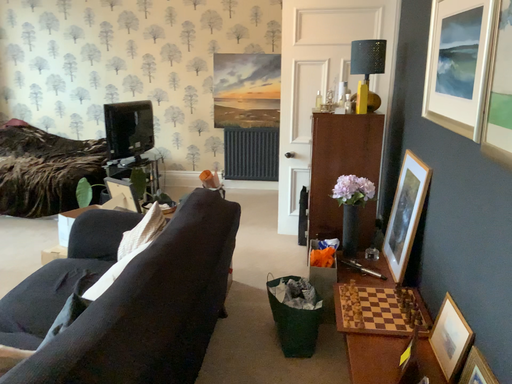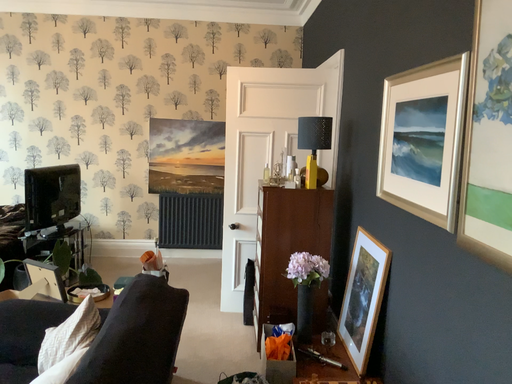
Question: How did the camera likely rotate when shooting the video?

Choices:
 (A) rotated left
 (B) rotated right

Answer: (B)